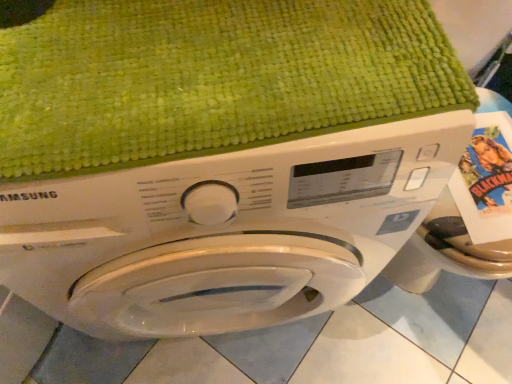
Locate an element on the screen. The width and height of the screenshot is (512, 384). green textured bath towel at upper center is located at coordinates (211, 78).

What do you see at coordinates (211, 78) in the screenshot? Image resolution: width=512 pixels, height=384 pixels. I see `green textured bath towel at upper center` at bounding box center [211, 78].

The image size is (512, 384). What do you see at coordinates (226, 231) in the screenshot? I see `white glossy washing machine at center` at bounding box center [226, 231].

Find the location of a particular element. The height and width of the screenshot is (384, 512). white glossy washing machine at center is located at coordinates (226, 231).

In order to face white glossy washing machine at center, should I rotate leftwards or rightwards?

To face it directly, rotate left by 6.178 degrees.

Where is `green textured bath towel at upper center`? The image size is (512, 384). green textured bath towel at upper center is located at coordinates (211, 78).

Which is more to the right, white glossy washing machine at center or green textured bath towel at upper center?

From the viewer's perspective, green textured bath towel at upper center appears more on the right side.

Which object is further away from the camera taking this photo, white glossy washing machine at center or green textured bath towel at upper center?

green textured bath towel at upper center is behind.

Does point (282, 208) appear closer or farther from the camera than point (13, 142)?

Point (282, 208) appears to be farther away from the viewer than point (13, 142).

From the image's perspective, is white glossy washing machine at center positioned above or below green textured bath towel at upper center?

Based on their image positions, white glossy washing machine at center is located beneath green textured bath towel at upper center.

From a real-world perspective, between white glossy washing machine at center and green textured bath towel at upper center, who is vertically higher?

In real-world perspective, green textured bath towel at upper center is above.

Can you confirm if white glossy washing machine at center is wider than green textured bath towel at upper center?

Indeed, white glossy washing machine at center has a greater width compared to green textured bath towel at upper center.

Which of these two, white glossy washing machine at center or green textured bath towel at upper center, stands shorter?

green textured bath towel at upper center.

Can you confirm if white glossy washing machine at center is smaller than green textured bath towel at upper center?

No.

Is white glossy washing machine at center not inside green textured bath towel at upper center?

white glossy washing machine at center is positioned outside green textured bath towel at upper center.

Is white glossy washing machine at center not close to green textured bath towel at upper center?

white glossy washing machine at center is actually quite close to green textured bath towel at upper center.

Is white glossy washing machine at center positioned with its back to green textured bath towel at upper center?

No.

You are a GUI agent. You are given a task and a screenshot of the screen. Output one action in this format:
    pyautogui.click(x=<x>, y=<y>)
    Task: Click on the bath towel behind the white glossy washing machine at center
    Image resolution: width=512 pixels, height=384 pixels.
    Given the screenshot: What is the action you would take?
    pyautogui.click(x=211, y=78)

Consider the image. Which object is positioned more to the left, green textured bath towel at upper center or white glossy washing machine at center?

From the viewer's perspective, white glossy washing machine at center appears more on the left side.

Which object is further away from the camera taking this photo, green textured bath towel at upper center or white glossy washing machine at center?

green textured bath towel at upper center.

Between point (163, 155) and point (271, 156), which one is positioned behind?

The point (271, 156) is more distant.

From the image's perspective, is green textured bath towel at upper center above white glossy washing machine at center?

Yes.

From a real-world perspective, is green textured bath towel at upper center physically above white glossy washing machine at center?

Yes, from a real-world perspective, green textured bath towel at upper center is above white glossy washing machine at center.

Considering the sizes of objects green textured bath towel at upper center and white glossy washing machine at center in the image provided, who is thinner, green textured bath towel at upper center or white glossy washing machine at center?

green textured bath towel at upper center is thinner.

Does green textured bath towel at upper center have a greater height compared to white glossy washing machine at center?

In fact, green textured bath towel at upper center may be shorter than white glossy washing machine at center.

Does green textured bath towel at upper center have a larger size compared to white glossy washing machine at center?

No, green textured bath towel at upper center is not bigger than white glossy washing machine at center.

Would you say green textured bath towel at upper center is outside white glossy washing machine at center?

Actually, green textured bath towel at upper center is within white glossy washing machine at center.

Is green textured bath towel at upper center with white glossy washing machine at center?

No, green textured bath towel at upper center is not with white glossy washing machine at center.

Is white glossy washing machine at center at the back of green textured bath towel at upper center?

Absolutely, green textured bath towel at upper center is directed away from white glossy washing machine at center.

How different are the orientations of green textured bath towel at upper center and white glossy washing machine at center in degrees?

The angular difference between green textured bath towel at upper center and white glossy washing machine at center is 0.000496 degrees.

The image size is (512, 384). I want to click on bath towel located behind the white glossy washing machine at center, so click(x=211, y=78).

Find the location of a particular element. bath towel lying above the white glossy washing machine at center (from the image's perspective) is located at coordinates (211, 78).

In the image, there is a green textured bath towel at upper center. At what (x,y) coordinates should I click in order to perform the action: click on washing machine below it (from the image's perspective). Please return your answer as a coordinate pair (x, y). This screenshot has width=512, height=384. Looking at the image, I should click on point(226,231).